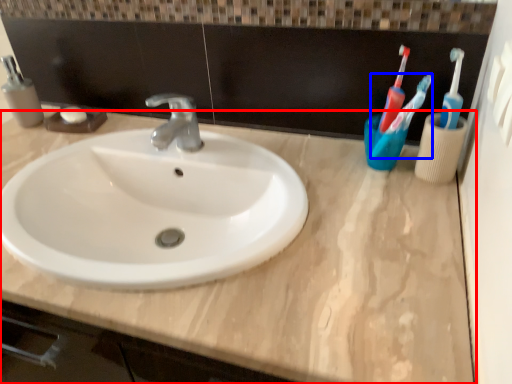
Question: Which of the following is the farthest to the observer, counter top (highlighted by a red box) or toothbrush (highlighted by a blue box)?

Choices:
 (A) counter top
 (B) toothbrush

Answer: (B)